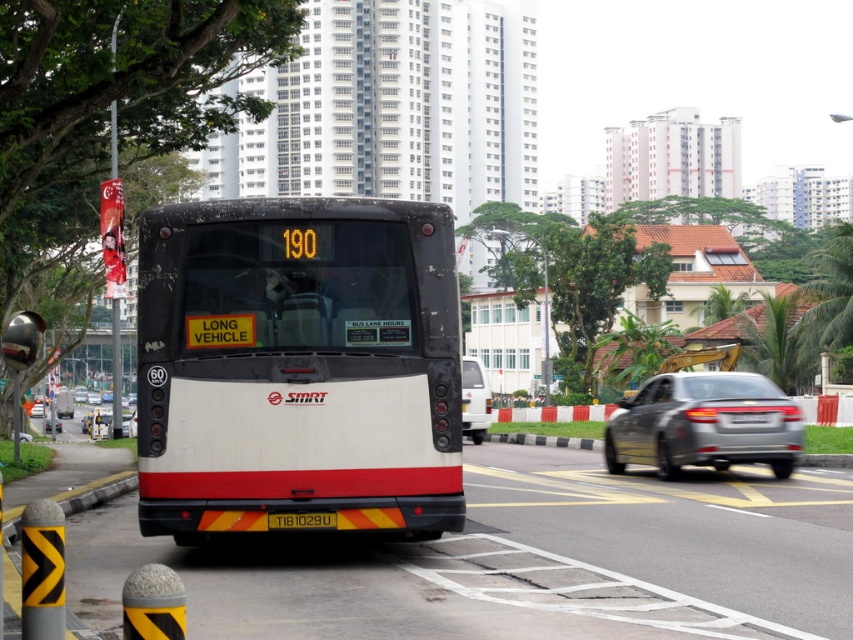
You are a delivery person who needs to load a package that requires a minimum height clearance of 2 meters. You see the white matte bus at center and the white matte van at center. Which vehicle can accommodate your package?

The white matte bus at center is much taller than the white matte van at center, so it can accommodate the package requiring a minimum height clearance of 2 meters.